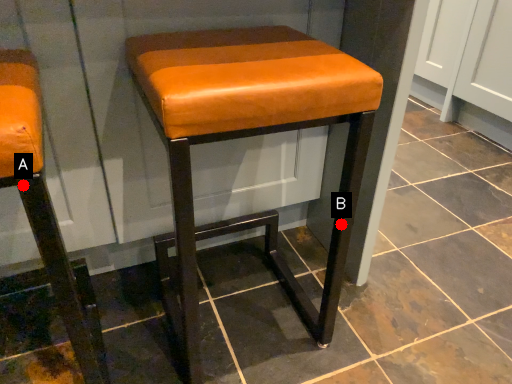
Question: Two points are circled on the image, labeled by A and B beside each circle. Which point is further to the camera?

Choices:
 (A) A is further
 (B) B is further

Answer: (A)